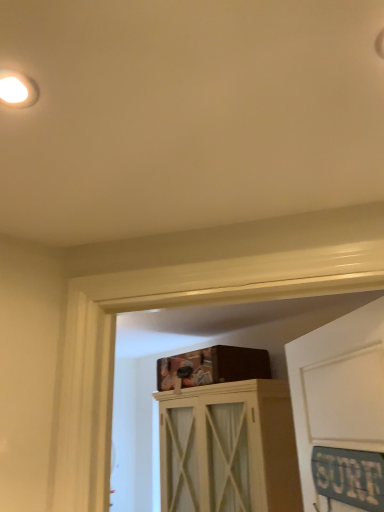
Image resolution: width=384 pixels, height=512 pixels. Describe the element at coordinates (228, 448) in the screenshot. I see `white wood cabinet at center` at that location.

The width and height of the screenshot is (384, 512). In order to click on white wood cabinet at center in this screenshot , I will do `click(228, 448)`.

Identify the location of white matte droplight at upper left. (18, 89).

Describe the element at coordinates (18, 89) in the screenshot. This screenshot has width=384, height=512. I see `white matte droplight at upper left` at that location.

You are a GUI agent. You are given a task and a screenshot of the screen. Output one action in this format:
    pyautogui.click(x=<x>, y=<y>)
    Task: Click on the white wood cabinet at center
    
    Given the screenshot: What is the action you would take?
    pyautogui.click(x=228, y=448)

Can you confirm if white wood cabinet at center is positioned to the left of white matte droplight at upper left?

No, white wood cabinet at center is not to the left of white matte droplight at upper left.

Considering the positions of objects white wood cabinet at center and white matte droplight at upper left in the image provided, who is behind, white wood cabinet at center or white matte droplight at upper left?

white wood cabinet at center is further away from the camera.

Between point (289, 430) and point (12, 74), which one is positioned in front?

Positioned in front is point (12, 74).

From the image's perspective, does white wood cabinet at center appear higher than white matte droplight at upper left?

No.

From a real-world perspective, is white wood cabinet at center on top of white matte droplight at upper left?

No, from a real-world perspective, white wood cabinet at center is not above white matte droplight at upper left.

Can you confirm if white wood cabinet at center is thinner than white matte droplight at upper left?

No.

Is white wood cabinet at center taller than white matte droplight at upper left?

Correct, white wood cabinet at center is much taller as white matte droplight at upper left.

Who is bigger, white wood cabinet at center or white matte droplight at upper left?

Bigger between the two is white wood cabinet at center.

Would you say white matte droplight at upper left is part of white wood cabinet at center's contents?

Actually, white matte droplight at upper left is outside white wood cabinet at center.

Does white wood cabinet at center touch white matte droplight at upper left?

They are not placed beside each other.

Is white wood cabinet at center positioned with its back to white matte droplight at upper left?

No, white matte droplight at upper left is not at the back of white wood cabinet at center.

Can you tell me how much white wood cabinet at center and white matte droplight at upper left differ in facing direction?

They differ by 85.6 degrees in their facing directions.

Measure the distance between white wood cabinet at center and white matte droplight at upper left.

white wood cabinet at center and white matte droplight at upper left are 7.81 feet apart.

This screenshot has height=512, width=384. In the image, there is a white wood cabinet at center. In order to click on droplight above it (from the image's perspective) in this screenshot , I will do `click(18, 89)`.

Is white matte droplight at upper left to the left or to the right of white wood cabinet at center in the image?

white matte droplight at upper left is to the left of white wood cabinet at center.

Considering the relative positions of white matte droplight at upper left and white wood cabinet at center in the image provided, is white matte droplight at upper left in front of white wood cabinet at center?

That is True.

Does point (34, 89) come in front of point (258, 472)?

Yes.

From the image's perspective, is white matte droplight at upper left below white wood cabinet at center?

Actually, white matte droplight at upper left appears above white wood cabinet at center in the image.

From a real-world perspective, which is physically below, white matte droplight at upper left or white wood cabinet at center?

white wood cabinet at center is physically lower.

Can you confirm if white matte droplight at upper left is wider than white wood cabinet at center?

In fact, white matte droplight at upper left might be narrower than white wood cabinet at center.

In the scene shown: From their relative heights in the image, would you say white matte droplight at upper left is taller or shorter than white wood cabinet at center?

In the image, white matte droplight at upper left appears to be shorter than white wood cabinet at center.

In terms of size, does white matte droplight at upper left appear bigger or smaller than white wood cabinet at center?

In the image, white matte droplight at upper left appears to be smaller than white wood cabinet at center.

Could white wood cabinet at center be considered to be inside white matte droplight at upper left?

No, white wood cabinet at center is not surrounded by white matte droplight at upper left.

Would you say white matte droplight at upper left is a long distance from white wood cabinet at center?

Indeed, white matte droplight at upper left is not near white wood cabinet at center.

Is white matte droplight at upper left turned away from white wood cabinet at center?

No.

In the image, there is a white matte droplight at upper left. In order to click on cabinetry below it (from a real-world perspective) in this screenshot , I will do `click(228, 448)`.

In the image, there is a white matte droplight at upper left. Where is `cabinetry below it (from the image's perspective)`? The width and height of the screenshot is (384, 512). cabinetry below it (from the image's perspective) is located at coordinates (228, 448).

Where is `droplight above the white wood cabinet at center (from a real-world perspective)`? This screenshot has width=384, height=512. droplight above the white wood cabinet at center (from a real-world perspective) is located at coordinates (18, 89).